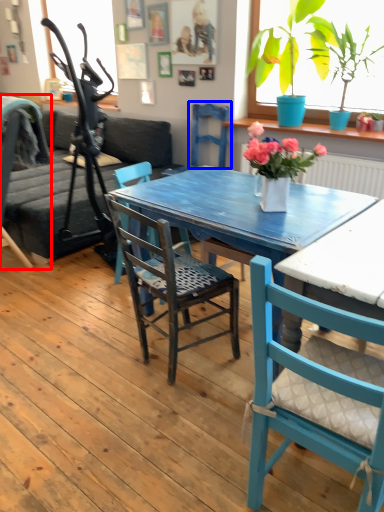
Question: Which of the following is the closest to the observer, chair (highlighted by a red box) or armchair (highlighted by a blue box)?

Choices:
 (A) chair
 (B) armchair

Answer: (A)